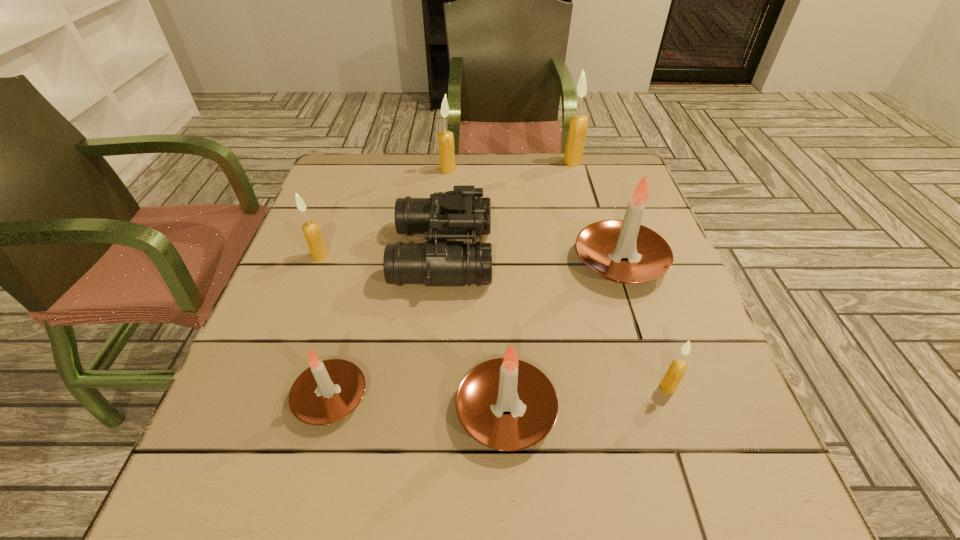
Identify the location of vacant space at the near left corner. (238, 517).

In the image, there is a desktop. What are the coordinates of `vacant area at the far right corner` in the screenshot? It's located at (585, 156).

This screenshot has height=540, width=960. I want to click on free space between the tallest object and the second white candle from right to left, so click(x=540, y=286).

Locate an element on the screen. free spot between the tallest candle and the fourth candle from left to right is located at coordinates [540, 286].

Image resolution: width=960 pixels, height=540 pixels. Identify the location of unoccupied position between the second smallest white candle and the leftmost cream candle. (413, 333).

The image size is (960, 540). I want to click on free area in between the fourth candle from right to left and the tallest object, so click(x=540, y=286).

The width and height of the screenshot is (960, 540). I want to click on empty location between the biggest white candle and the binoculars, so click(532, 258).

Image resolution: width=960 pixels, height=540 pixels. What are the coordinates of `unoccupied position between the fifth candle from right to left and the nearest cream candle` in the screenshot? It's located at (558, 278).

Where is `free spot between the leftmost white candle and the biggest white candle`? free spot between the leftmost white candle and the biggest white candle is located at coordinates (475, 330).

Find the location of `vacant area that lies between the tallest object and the rightmost white candle`. vacant area that lies between the tallest object and the rightmost white candle is located at coordinates click(x=596, y=212).